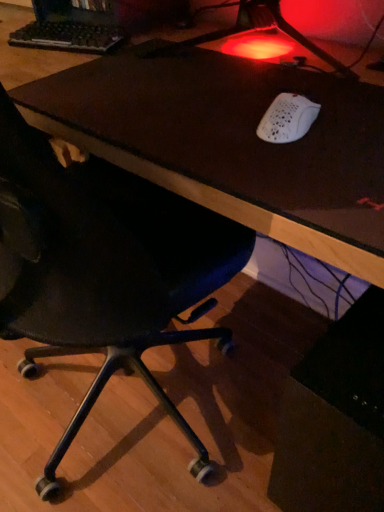
Locate an element on the screen. The height and width of the screenshot is (512, 384). free space in front of black plastic keyboard at upper left is located at coordinates (59, 67).